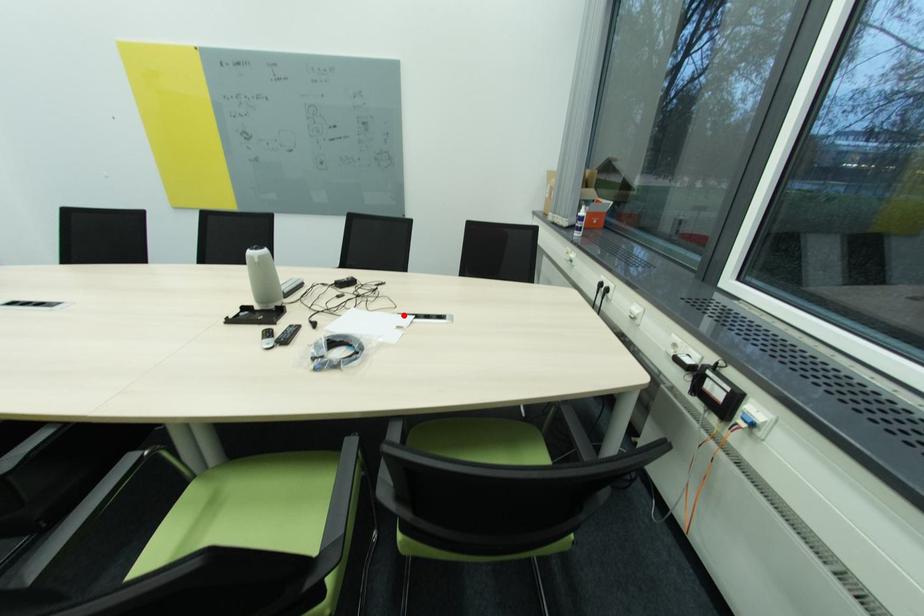
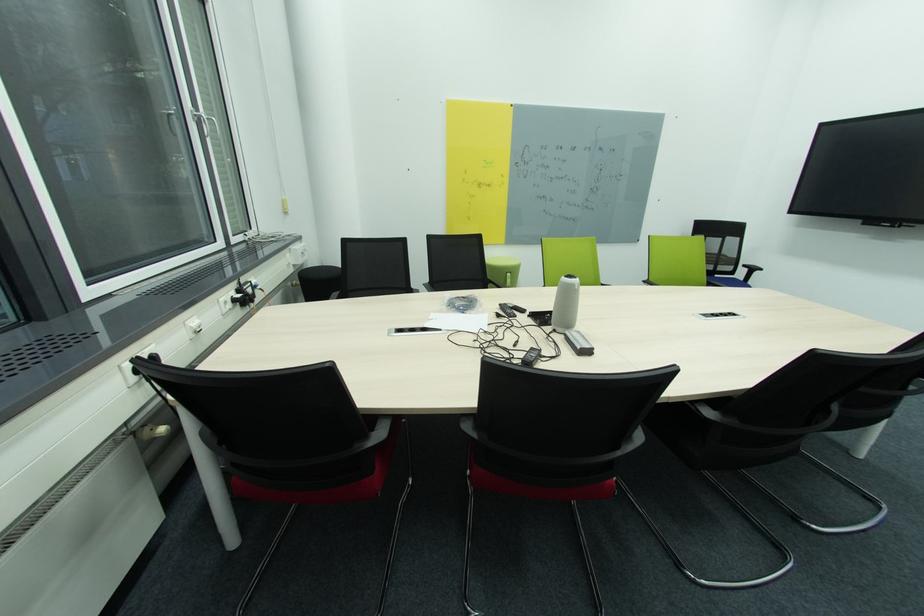
Where in the second image is the point corresponding to the highlighted location from the first image?

(444, 331)